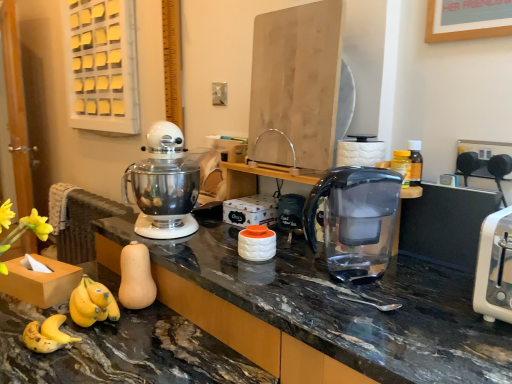
This screenshot has width=512, height=384. Find the location of `free point behind white plastic toaster at right`. free point behind white plastic toaster at right is located at coordinates (434, 276).